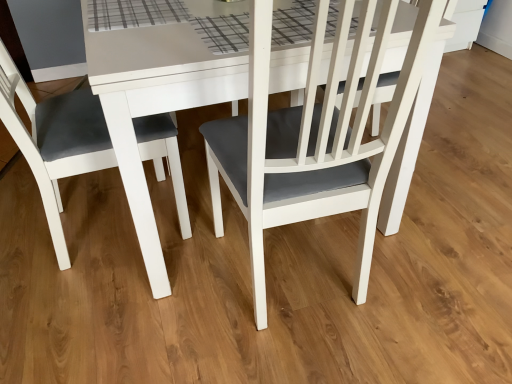
Where is `matte white chair at center, the 2th chair from the left`? Image resolution: width=512 pixels, height=384 pixels. matte white chair at center, the 2th chair from the left is located at coordinates (314, 137).

The image size is (512, 384). What do you see at coordinates (314, 137) in the screenshot?
I see `matte white chair at center, acting as the first chair starting from the right` at bounding box center [314, 137].

Describe the element at coordinates (55, 140) in the screenshot. I see `matte white chair at left, the first chair positioned from the left` at that location.

Measure the distance between point (92, 155) and camera.

1.23 meters.

You are a GUI agent. You are given a task and a screenshot of the screen. Output one action in this format:
    pyautogui.click(x=<x>, y=<y>)
    Task: Click on the matte white chair at left, which ranks as the second chair in right-to-left order
    This screenshot has height=384, width=512.
    Given the screenshot: What is the action you would take?
    pyautogui.click(x=55, y=140)

In order to click on matte white chair at center, the 2th chair from the left in this screenshot , I will do `click(314, 137)`.

Can you confirm if matte white chair at left, the first chair positioned from the left, is positioned to the left of matte white chair at center, acting as the first chair starting from the right?

Yes, matte white chair at left, the first chair positioned from the left, is to the left of matte white chair at center, acting as the first chair starting from the right.

Considering the relative positions of matte white chair at left, the first chair positioned from the left, and matte white chair at center, the 2th chair from the left, in the image provided, is matte white chair at left, the first chair positioned from the left, behind matte white chair at center, the 2th chair from the left,?

No, matte white chair at left, the first chair positioned from the left, is closer to the viewer.

Which is in front, point (167, 127) or point (376, 199)?

Point (376, 199)

From the image's perspective, who appears lower, matte white chair at left, which ranks as the second chair in right-to-left order, or matte white chair at center, acting as the first chair starting from the right?

matte white chair at left, which ranks as the second chair in right-to-left order, appears lower in the image.

From a real-world perspective, relative to matte white chair at center, acting as the first chair starting from the right, is matte white chair at left, the first chair positioned from the left, vertically above or below?

Clearly, from a real-world perspective, matte white chair at left, the first chair positioned from the left, is above matte white chair at center, acting as the first chair starting from the right.

Considering the sizes of objects matte white chair at left, which ranks as the second chair in right-to-left order, and matte white chair at center, acting as the first chair starting from the right, in the image provided, who is wider, matte white chair at left, which ranks as the second chair in right-to-left order, or matte white chair at center, acting as the first chair starting from the right,?

matte white chair at center, acting as the first chair starting from the right.

Who is taller, matte white chair at left, which ranks as the second chair in right-to-left order, or matte white chair at center, the 2th chair from the left?

Standing taller between the two is matte white chair at left, which ranks as the second chair in right-to-left order.

Which of these two, matte white chair at left, which ranks as the second chair in right-to-left order, or matte white chair at center, acting as the first chair starting from the right, is bigger?

matte white chair at center, acting as the first chair starting from the right.

Based on the photo, is matte white chair at center, acting as the first chair starting from the right, located within matte white chair at left, which ranks as the second chair in right-to-left order?

No, matte white chair at center, acting as the first chair starting from the right, is not inside matte white chair at left, which ranks as the second chair in right-to-left order.

Is there a large distance between matte white chair at left, which ranks as the second chair in right-to-left order, and matte white chair at center, acting as the first chair starting from the right?

No, matte white chair at left, which ranks as the second chair in right-to-left order, is not far from matte white chair at center, acting as the first chair starting from the right.

Could you tell me if matte white chair at left, which ranks as the second chair in right-to-left order, is facing matte white chair at center, acting as the first chair starting from the right?

Yes, matte white chair at left, which ranks as the second chair in right-to-left order, is turned towards matte white chair at center, acting as the first chair starting from the right.

At what (x,y) coordinates should I click in order to perform the action: click on chair above the matte white chair at left, which ranks as the second chair in right-to-left order (from the image's perspective). Please return your answer as a coordinate pair (x, y). The image size is (512, 384). Looking at the image, I should click on (314, 137).

Can you confirm if matte white chair at center, acting as the first chair starting from the right, is positioned to the right of matte white chair at left, which ranks as the second chair in right-to-left order?

Indeed, matte white chair at center, acting as the first chair starting from the right, is positioned on the right side of matte white chair at left, which ranks as the second chair in right-to-left order.

Which object is further away from the camera taking this photo, matte white chair at center, acting as the first chair starting from the right, or matte white chair at left, which ranks as the second chair in right-to-left order?

matte white chair at center, acting as the first chair starting from the right, is further from the camera.

Considering the positions of points (314, 176) and (179, 217), is point (314, 176) farther from camera compared to point (179, 217)?

That is False.

From the image's perspective, which one is positioned lower, matte white chair at center, acting as the first chair starting from the right, or matte white chair at left, which ranks as the second chair in right-to-left order?

matte white chair at left, which ranks as the second chair in right-to-left order.

In the scene shown: From a real-world perspective, is matte white chair at center, the 2th chair from the left, on top of matte white chair at left, the first chair positioned from the left?

No.

Between matte white chair at center, acting as the first chair starting from the right, and matte white chair at left, which ranks as the second chair in right-to-left order, which one has larger width?

matte white chair at center, acting as the first chair starting from the right.

Considering the sizes of matte white chair at center, the 2th chair from the left, and matte white chair at left, the first chair positioned from the left, in the image, is matte white chair at center, the 2th chair from the left, taller or shorter than matte white chair at left, the first chair positioned from the left,?

Clearly, matte white chair at center, the 2th chair from the left, is shorter compared to matte white chair at left, the first chair positioned from the left.

Can you confirm if matte white chair at center, the 2th chair from the left, is smaller than matte white chair at left, the first chair positioned from the left?

No, matte white chair at center, the 2th chair from the left, is not smaller than matte white chair at left, the first chair positioned from the left.

Is matte white chair at center, the 2th chair from the left, outside of matte white chair at left, the first chair positioned from the left?

Yes, matte white chair at center, the 2th chair from the left, is outside of matte white chair at left, the first chair positioned from the left.

Is matte white chair at center, acting as the first chair starting from the right, positioned far away from matte white chair at left, which ranks as the second chair in right-to-left order?

No, matte white chair at center, acting as the first chair starting from the right, is not far from matte white chair at left, which ranks as the second chair in right-to-left order.

Could you tell me if matte white chair at center, acting as the first chair starting from the right, is turned towards matte white chair at left, which ranks as the second chair in right-to-left order?

No, matte white chair at center, acting as the first chair starting from the right, does not turn towards matte white chair at left, which ranks as the second chair in right-to-left order.

How many degrees apart are the facing directions of matte white chair at center, the 2th chair from the left, and matte white chair at left, the first chair positioned from the left?

The angle between the facing direction of matte white chair at center, the 2th chair from the left, and the facing direction of matte white chair at left, the first chair positioned from the left, is 93.8 degrees.

This screenshot has height=384, width=512. In order to click on chair below the matte white chair at center, acting as the first chair starting from the right (from the image's perspective) in this screenshot , I will do `click(55, 140)`.

The width and height of the screenshot is (512, 384). In order to click on chair that is in front of the matte white chair at center, acting as the first chair starting from the right in this screenshot , I will do `click(55, 140)`.

Identify the location of chair below the matte white chair at center, the 2th chair from the left (from the image's perspective). (55, 140).